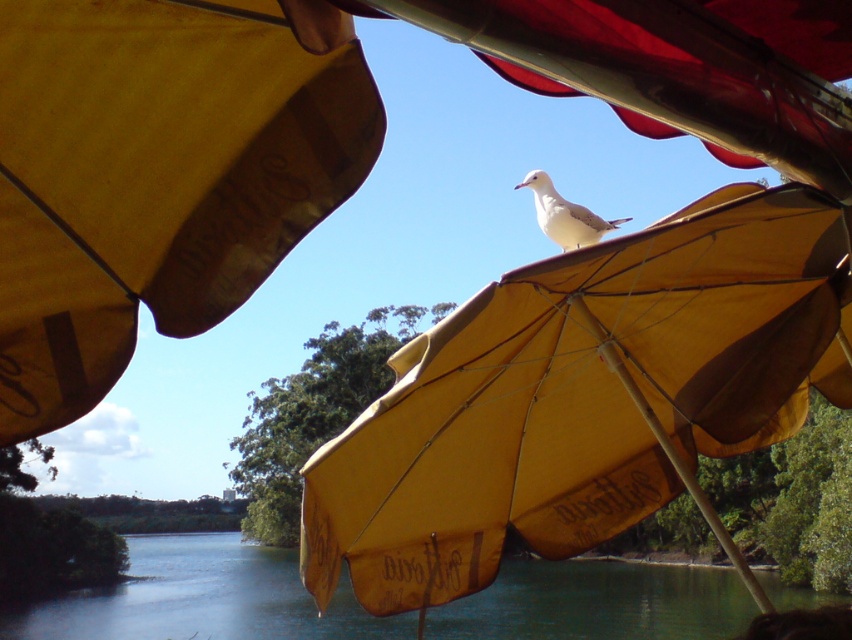
You are a painter standing at the edge of the shaded area under the umbrellas. You want to paint the white matte bird at center without moving your position. Can you see the top of the yellow fabric umbrella at center from your current viewpoint?

The yellow fabric umbrella at center has a greater height compared to the white matte bird at center, so yes, you can see the top of the yellow fabric umbrella at center because it is taller than the bird.

You are a bird looking for a place to land. There are two umbrellas in the scene, the yellow matte umbrella at upper center and the yellow fabric umbrella at center. Which umbrella is located above the other?

The yellow matte umbrella at upper center is positioned over the yellow fabric umbrella at center.

You are a photographer trying to capture a clear shot of the yellow fabric umbrella at center. However, the yellow matte umbrella at upper center is blocking your view. Can you adjust your position to avoid the obstruction?

The yellow matte umbrella at upper center is in front of the yellow fabric umbrella at center, so moving your position to the side or behind the yellow matte umbrella at upper center would allow you to see the yellow fabric umbrella at center without obstruction.